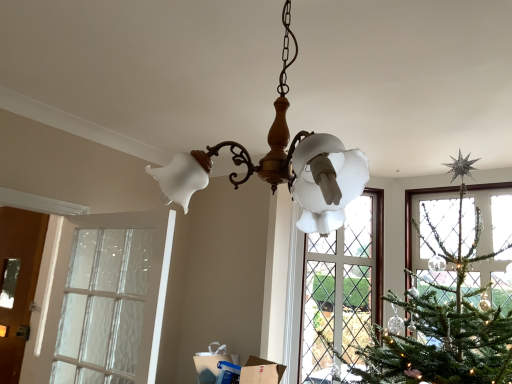
Question: From their relative heights in the image, would you say matte white glass chandelier at center is taller or shorter than clear glass door at left?

Choices:
 (A) short
 (B) tall

Answer: (A)

Question: In terms of size, does matte white glass chandelier at center appear bigger or smaller than clear glass door at left?

Choices:
 (A) small
 (B) big

Answer: (B)

Question: Based on their relative distances, which object is nearer to the clear glass door at left?

Choices:
 (A) brown wooden door at left
 (B) matte white glass chandelier at center

Answer: (A)

Question: Which is nearer to the clear glass door at left?

Choices:
 (A) brown wooden door at left
 (B) matte white glass chandelier at center

Answer: (A)